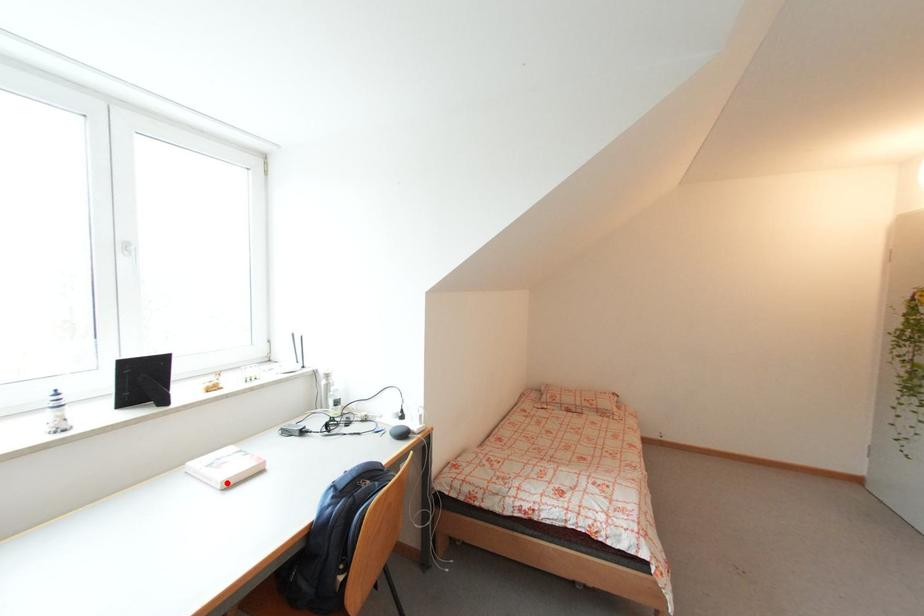
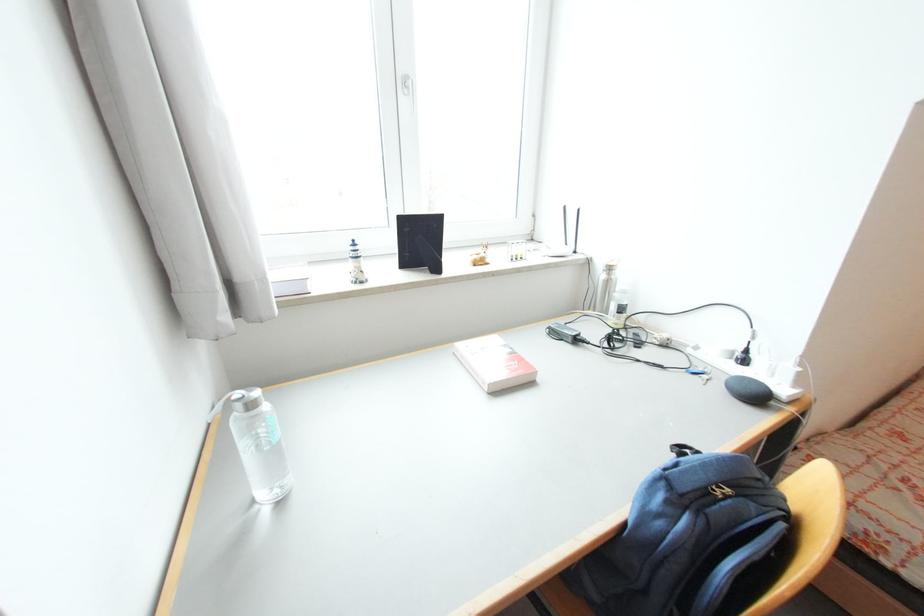
Locate, in the second image, the point that corresponds to the highlighted location in the first image.

(493, 386)